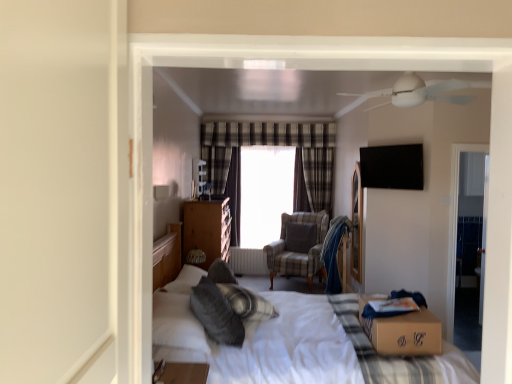
Image resolution: width=512 pixels, height=384 pixels. What do you see at coordinates (403, 331) in the screenshot? I see `brown cardboard box at lower right` at bounding box center [403, 331].

Locate an element on the screen. The image size is (512, 384). wooden nightstand at center is located at coordinates (207, 229).

What are the coordinates of `brown cardboard box at lower right` in the screenshot? It's located at (403, 331).

How far apart are gray fabric pillow at center, which ranks as the 2th pillow in left-to-right order, and brown cardboard box at lower right?

gray fabric pillow at center, which ranks as the 2th pillow in left-to-right order, and brown cardboard box at lower right are 7.71 feet apart from each other.

Could you tell me if gray fabric pillow at center, the 1th pillow from the back, is facing brown cardboard box at lower right?

No, gray fabric pillow at center, the 1th pillow from the back, is not oriented towards brown cardboard box at lower right.

Is point (291, 249) positioned behind point (420, 309)?

Yes, it is.

Considering the positions of objects gray fabric pillow at center, placed as the 2th pillow when sorted from front to back, and brown cardboard box at lower right in the image provided, who is in front, gray fabric pillow at center, placed as the 2th pillow when sorted from front to back, or brown cardboard box at lower right?

Positioned in front is brown cardboard box at lower right.

Does brown cardboard box at lower right have a larger size compared to brown cardboard box at center?

Incorrect, brown cardboard box at lower right is not larger than brown cardboard box at center.

Is brown cardboard box at lower right next to brown cardboard box at center and touching it?

No.

Which is more to the right, brown cardboard box at lower right or brown cardboard box at center?

brown cardboard box at lower right.

Is brown cardboard box at lower right taller than brown cardboard box at center?

Incorrect, the height of brown cardboard box at lower right is not larger of that of brown cardboard box at center.

Image resolution: width=512 pixels, height=384 pixels. I want to click on pillow that is the 1st object located below the plaid fabric curtain at center (from the image's perspective), so point(300,237).

From the image's perspective, which is below, plaid fabric curtain at center or gray fabric pillow at center, the 1th pillow from the back?

gray fabric pillow at center, the 1th pillow from the back.

Is plaid fabric curtain at center closer to camera compared to gray fabric pillow at center, which ranks as the 2th pillow in left-to-right order?

No.

Would you say plaid fabric curtain at center is a long distance from gray fabric pillow at center, the 1th pillow from the back?

plaid fabric curtain at center is near gray fabric pillow at center, the 1th pillow from the back, not far away.

Which is in front, point (328, 168) or point (308, 220)?

Positioned in front is point (308, 220).

Is plaid fabric curtain at center looking in the opposite direction of plaid fabric armchair at center?

No, plaid fabric curtain at center's orientation is not away from plaid fabric armchair at center.

This screenshot has height=384, width=512. What are the coordinates of `chair that is on the left side of plaid fabric curtain at center` in the screenshot? It's located at (298, 246).

Considering the sizes of objects plaid fabric curtain at center and plaid fabric armchair at center in the image provided, who is bigger, plaid fabric curtain at center or plaid fabric armchair at center?

plaid fabric armchair at center.

The width and height of the screenshot is (512, 384). Identify the location of radiator below the plaid fabric curtain at center (from a real-world perspective). (248, 261).

Is white metallic radiator at center far away from plaid fabric curtain at center?

white metallic radiator at center is positioned a significant distance from plaid fabric curtain at center.

Consider the image. Is white metallic radiator at center taller than plaid fabric curtain at center?

In fact, white metallic radiator at center may be shorter than plaid fabric curtain at center.

Which object is positioned more to the right, white metallic radiator at center or plaid fabric curtain at center?

plaid fabric curtain at center.

Which is more to the right, white soft bed at center or plaid fabric armchair at center?

Positioned to the right is plaid fabric armchair at center.

You are a GUI agent. You are given a task and a screenshot of the screen. Output one action in this format:
    pyautogui.click(x=<x>, y=<y>)
    Task: Click on the chair above the white soft bed at center (from the image's perspective)
    
    Given the screenshot: What is the action you would take?
    pyautogui.click(x=298, y=246)

From a real-world perspective, is white soft bed at center positioned under plaid fabric armchair at center based on gravity?

No, from a real-world perspective, white soft bed at center is not below plaid fabric armchair at center.

Are white soft bed at center and plaid fabric armchair at center located far from each other?

white soft bed at center is far away from plaid fabric armchair at center.

In the scene shown: Is brown cardboard box at lower right oriented towards white metallic radiator at center?

No, brown cardboard box at lower right is not aimed at white metallic radiator at center.

Based on the photo, is brown cardboard box at lower right taller than white metallic radiator at center?

Incorrect, the height of brown cardboard box at lower right is not larger of that of white metallic radiator at center.

Looking at their sizes, would you say brown cardboard box at lower right is wider or thinner than white metallic radiator at center?

In the image, brown cardboard box at lower right appears to be wider than white metallic radiator at center.

Locate an element on the screen. Image resolution: width=512 pixels, height=384 pixels. box that appears on the right of gray fabric pillow at center, which ranks as the 2th pillow in left-to-right order is located at coordinates click(x=403, y=331).

Identify the location of mattress on the left side of brown cardboard box at lower right. [x=399, y=356].

From the image, which object appears to be nearer to white metallic radiator at center, soft gray pillow at center, which appears as the 2th pillow when viewed from the right, or white soft bed at center?

The object closer to white metallic radiator at center is white soft bed at center.

Estimate the real-world distances between objects in this image. Which object is further from transparent glass window screen at center, brown cardboard box at lower right or plaid fabric armchair at center?

The object further to transparent glass window screen at center is brown cardboard box at lower right.

Based on their spatial positions, is gray fabric pillow at center, arranged as the first pillow when viewed from the right, or brown cardboard box at lower right further from wooden nightstand at center?

Based on the image, brown cardboard box at lower right appears to be further to wooden nightstand at center.

Looking at the image, which one is located further to brown cardboard box at lower right, wooden nightstand at center or plaid fabric armchair at center?

wooden nightstand at center lies further to brown cardboard box at lower right than the other object.

When comparing their distances from plaid fabric curtain at center, does white soft bed at center or wooden nightstand at center seem closer?

wooden nightstand at center is closer to plaid fabric curtain at center.

Estimate the real-world distances between objects in this image. Which object is further from plaid fabric curtain at center, brown cardboard box at lower right or plaid fabric armchair at center?

Based on the image, brown cardboard box at lower right appears to be further to plaid fabric curtain at center.

Estimate the real-world distances between objects in this image. Which object is closer to white metallic radiator at center, brown cardboard box at lower right or soft gray pillow at center, the second pillow from the back?

soft gray pillow at center, the second pillow from the back, lies closer to white metallic radiator at center than the other object.

When comparing their distances from gray fabric pillow at center, placed as the 2th pillow when sorted from front to back, does transparent glass window screen at center or soft gray pillow at center, which appears as the 2th pillow when viewed from the right, seem further?

soft gray pillow at center, which appears as the 2th pillow when viewed from the right, is positioned further to the anchor gray fabric pillow at center, placed as the 2th pillow when sorted from front to back.

Where is `bed between brown cardboard box at center and plaid fabric curtain at center along the z-axis`? The image size is (512, 384). bed between brown cardboard box at center and plaid fabric curtain at center along the z-axis is located at coordinates (260, 339).

Locate an element on the screen. Image resolution: width=512 pixels, height=384 pixels. chair between brown cardboard box at lower right and transparent glass window screen at center along the z-axis is located at coordinates (298, 246).

The image size is (512, 384). I want to click on box positioned between brown cardboard box at center and wooden nightstand at center from near to far, so click(403, 331).

Image resolution: width=512 pixels, height=384 pixels. Find the location of `nightstand located between brown cardboard box at lower right and plaid fabric armchair at center in the depth direction`. nightstand located between brown cardboard box at lower right and plaid fabric armchair at center in the depth direction is located at coordinates (207, 229).